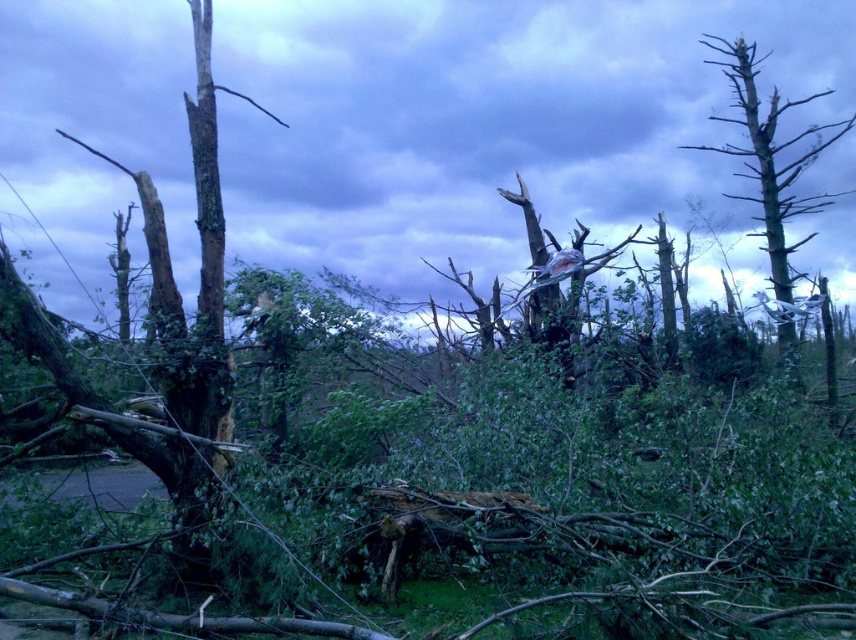
Is dead wood debris at center thinner than bare wood tree at right?

Incorrect, dead wood debris at center's width is not less than bare wood tree at right's.

Can you confirm if dead wood debris at center is positioned to the left of bare wood tree at right?

Yes, dead wood debris at center is to the left of bare wood tree at right.

Which is in front, point (513, 250) or point (783, 280)?

Positioned in front is point (783, 280).

Where is `dead wood debris at center`? This screenshot has width=856, height=640. dead wood debris at center is located at coordinates (495, 125).